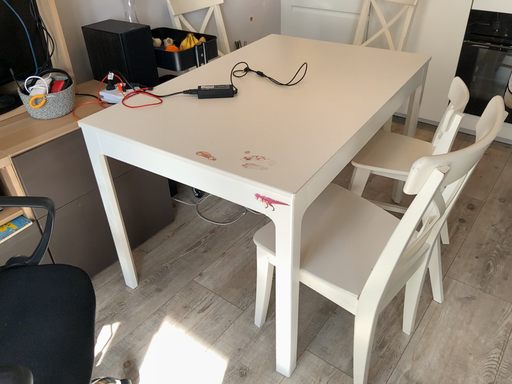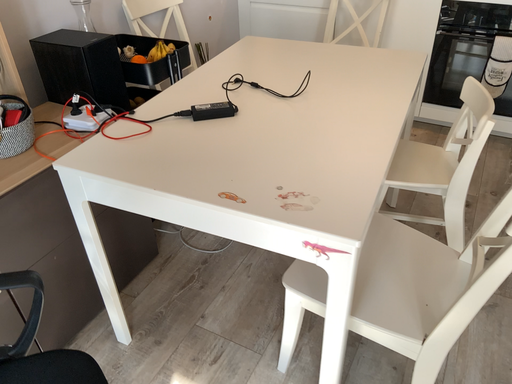
Question: How did the camera likely rotate when shooting the video?

Choices:
 (A) rotated left
 (B) rotated right

Answer: (B)